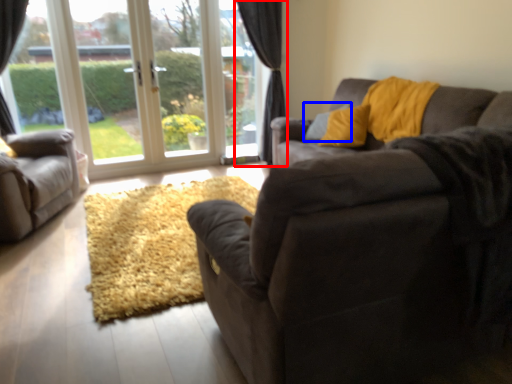
Question: Which of the following is the farthest to the observer, curtain (highlighted by a red box) or pillow (highlighted by a blue box)?

Choices:
 (A) curtain
 (B) pillow

Answer: (A)